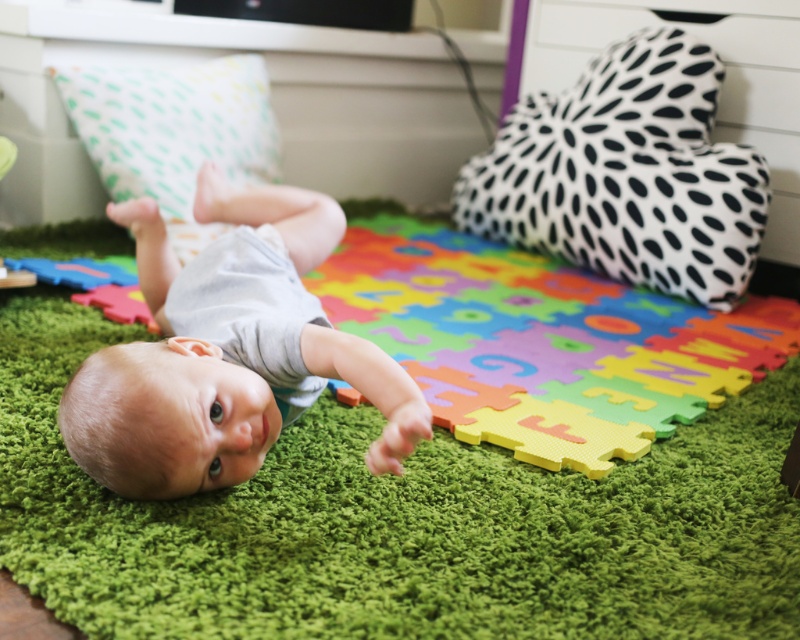
Is smooth gray baby at center to the left of rubberized foam puzzle piece at lower left from the viewer's perspective?

No, smooth gray baby at center is not to the left of rubberized foam puzzle piece at lower left.

Which is more to the left, smooth gray baby at center or rubberized foam puzzle piece at lower left?

rubberized foam puzzle piece at lower left

Is point (169, 458) farther from camera compared to point (120, 285)?

No.

Where is `smooth gray baby at center`? This screenshot has height=640, width=800. smooth gray baby at center is located at coordinates (226, 353).

Does green foam puzzle mat at center have a lesser width compared to smooth gray baby at center?

No, green foam puzzle mat at center is not thinner than smooth gray baby at center.

Does green foam puzzle mat at center have a lesser height compared to smooth gray baby at center?

Incorrect, green foam puzzle mat at center's height does not fall short of smooth gray baby at center's.

In order to click on green foam puzzle mat at center in this screenshot , I will do `click(397, 524)`.

Does green foam puzzle mat at center have a greater height compared to rubberized foam puzzle piece at lower left?

Correct, green foam puzzle mat at center is much taller as rubberized foam puzzle piece at lower left.

Is green foam puzzle mat at center bigger than rubberized foam puzzle piece at lower left?

Indeed, green foam puzzle mat at center has a larger size compared to rubberized foam puzzle piece at lower left.

Describe the element at coordinates (397, 524) in the screenshot. This screenshot has height=640, width=800. I see `green foam puzzle mat at center` at that location.

The width and height of the screenshot is (800, 640). In order to click on green foam puzzle mat at center in this screenshot , I will do (x=397, y=524).